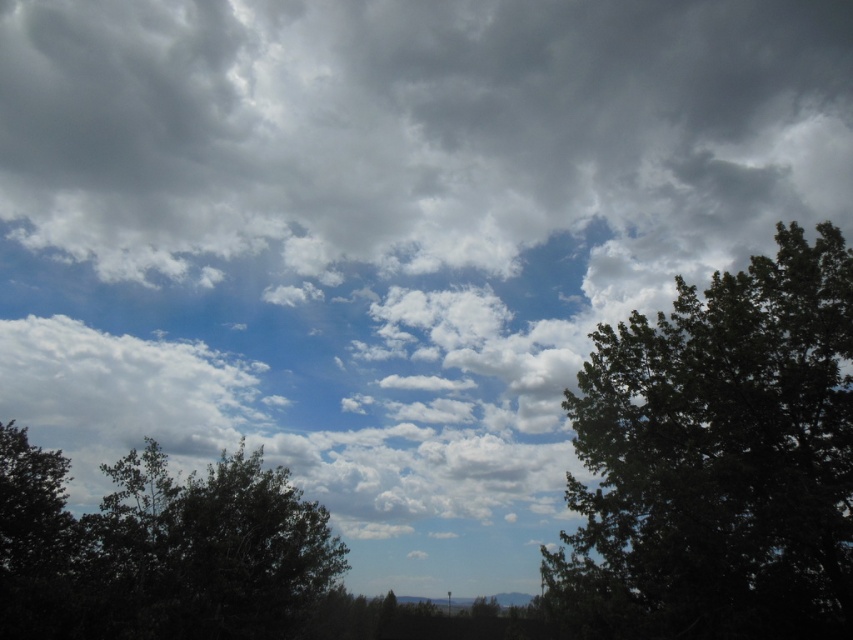
You are standing in a field and see the green leafy tree at right and the dark green leafy tree at lower left. If you want to walk directly between them, how far apart are these two trees?

The green leafy tree at right and the dark green leafy tree at lower left are 17.03 meters apart, so you would need to walk that distance to go between them.

You are standing in front of the trees and looking at the sky scene. There are two points marked in the image. Which point, point (x=693, y=212) or point (x=614, y=349), is closer to you?

Point (x=693, y=212) is further to the camera than point (x=614, y=349), so the point closer to you is point (x=614, y=349).

You are standing in a field looking at the sky scene. You want to take a photo of the green leafy tree at right. Where should you point your camera?

You should point your camera at point (718, 460) to capture the green leafy tree at right.